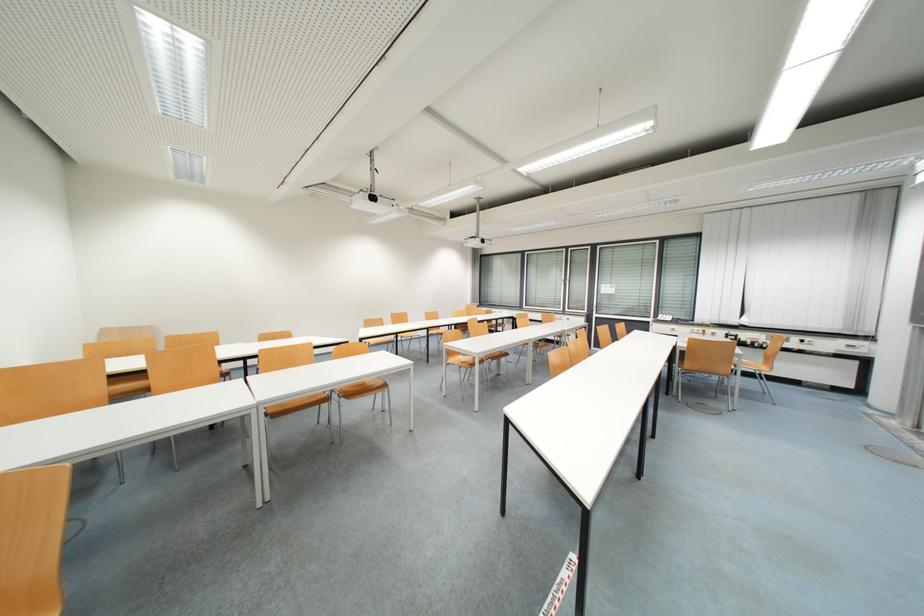
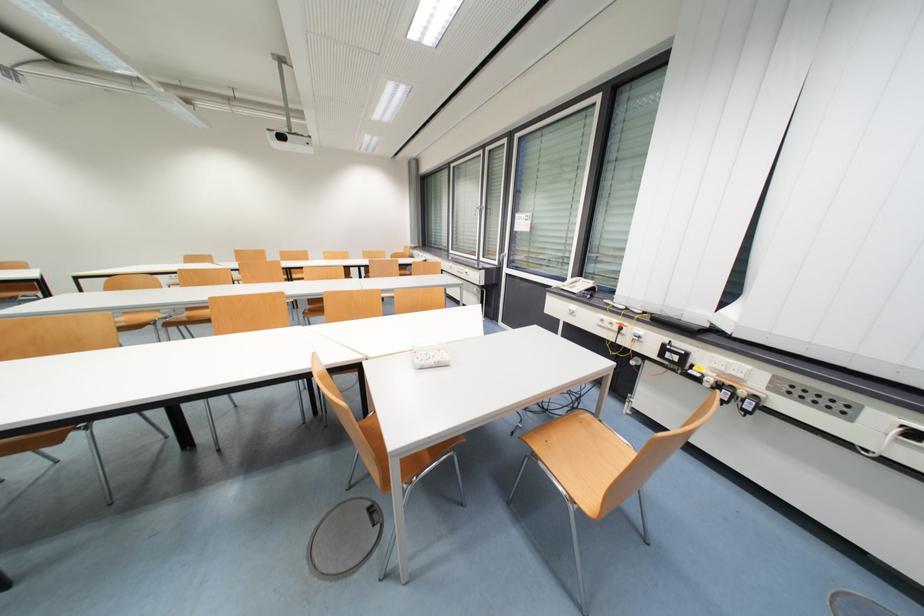
Locate, in the second image, the point that corresponds to [488,243] in the first image.

(286, 139)